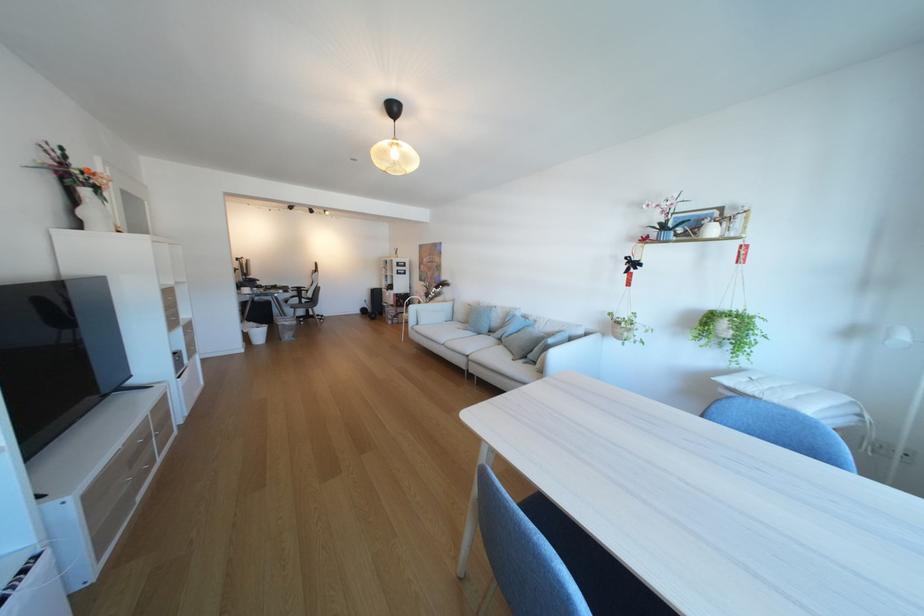
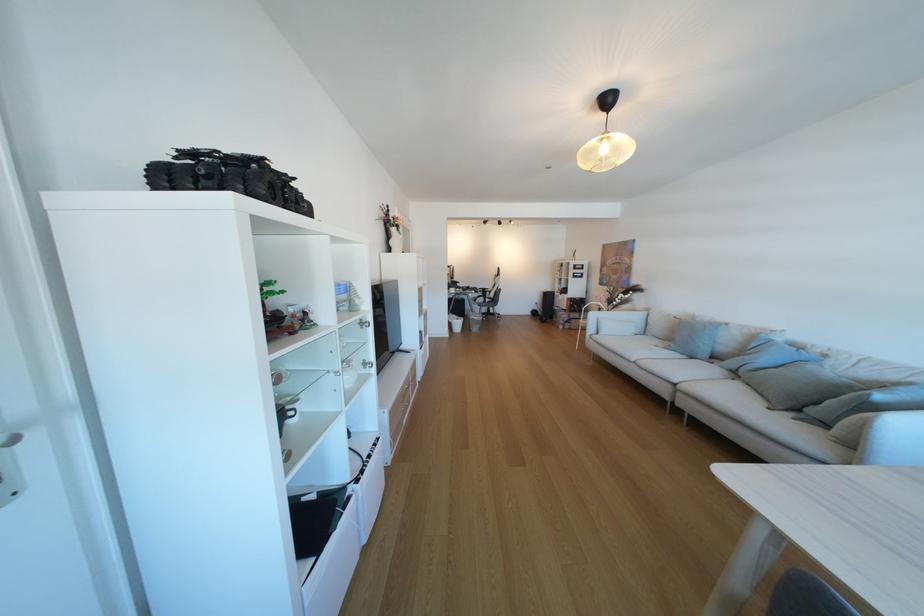
Where in the second image is the point corresponding to point (89, 225) from the first image?

(400, 251)